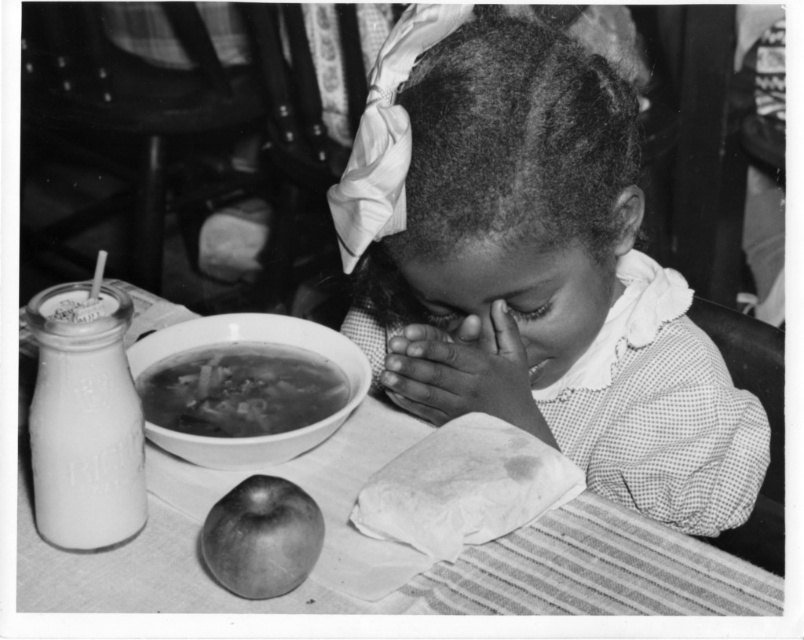
Is white opaque glass bottle at left closer to the viewer compared to smooth skin hands at center?

Yes, it is.

Does white opaque glass bottle at left have a larger size compared to smooth skin hands at center?

Yes.

Between point (107, 429) and point (409, 369), which one is positioned behind?

The point (409, 369) is behind.

Locate an element on the screen. This screenshot has width=804, height=640. white opaque glass bottle at left is located at coordinates point(84,420).

Who is more forward, (470, 561) or (117, 323)?

Point (117, 323) is more forward.

Does smooth white table at center have a greater height compared to white opaque glass bottle at left?

No, smooth white table at center is not taller than white opaque glass bottle at left.

Locate an element on the screen. This screenshot has width=804, height=640. smooth white table at center is located at coordinates (597, 572).

Identify the location of smooth white table at center. This screenshot has height=640, width=804. (597, 572).

Based on the photo, which is more to the right, smooth white table at center or white ceramic bowl at upper center?

Positioned to the right is smooth white table at center.

Which is in front, point (737, 570) or point (269, 337)?

Positioned in front is point (737, 570).

What do you see at coordinates (597, 572) in the screenshot?
I see `smooth white table at center` at bounding box center [597, 572].

The width and height of the screenshot is (804, 640). I want to click on smooth white table at center, so click(597, 572).